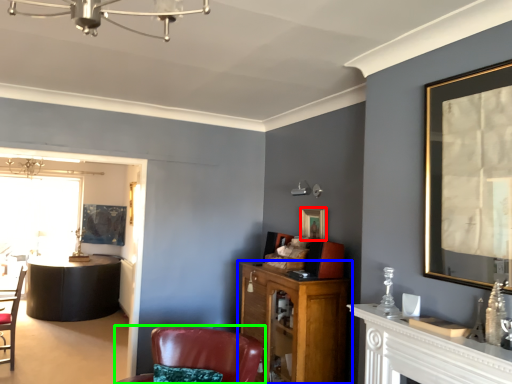
Question: Which is farther away from picture frame (highlighted by a red box)? cabinetry (highlighted by a blue box) or chair (highlighted by a green box)?

Choices:
 (A) cabinetry
 (B) chair

Answer: (B)